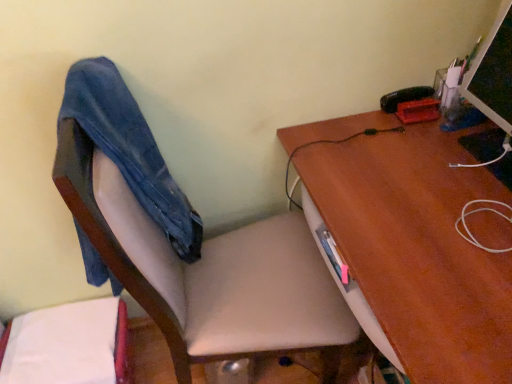
Image resolution: width=512 pixels, height=384 pixels. In order to click on free space in front of matte black monitor at upper right in this screenshot , I will do `click(481, 178)`.